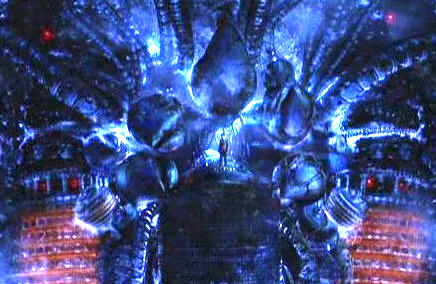
Locate an element on the screen. bulb is located at coordinates (99, 205), (140, 177), (105, 143), (151, 119), (297, 184), (316, 223).